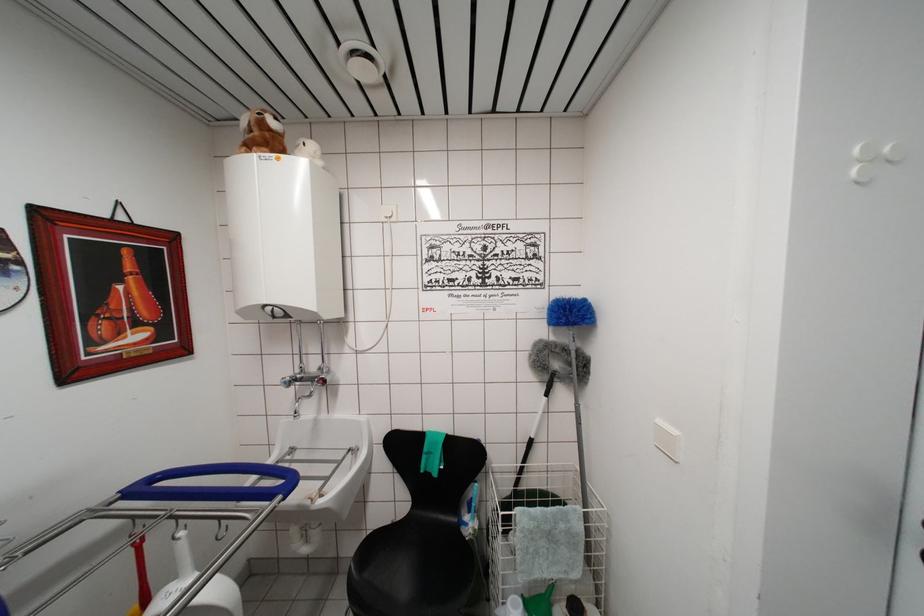
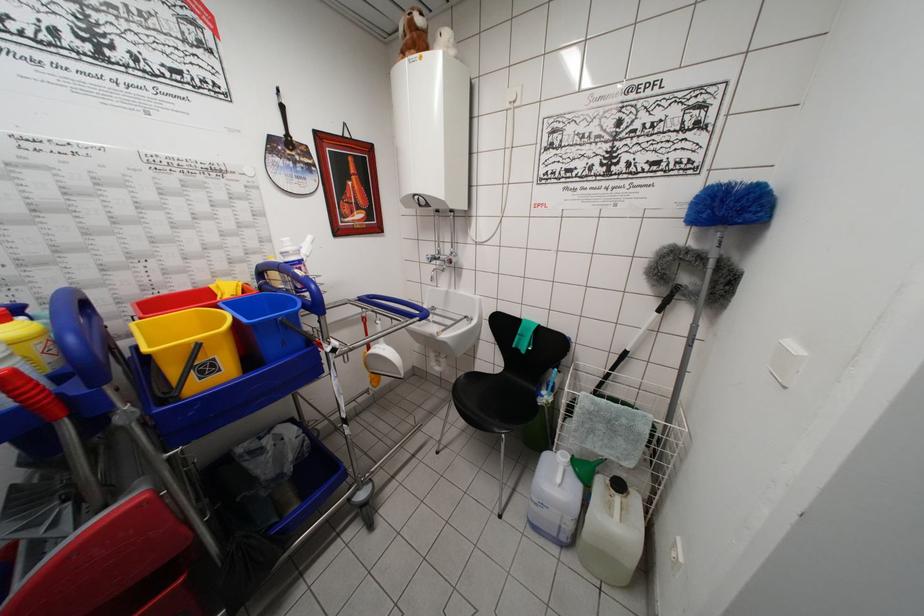
In the second image, find the point that corresponds to (x=528, y=466) in the first image.

(616, 374)